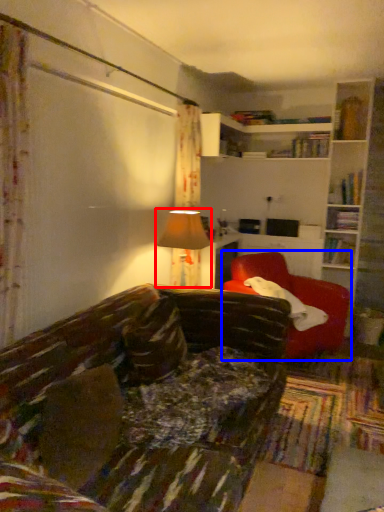
Question: Which of the following is the closest to the observer, table lamp (highlighted by a red box) or chair (highlighted by a blue box)?

Choices:
 (A) table lamp
 (B) chair

Answer: (A)